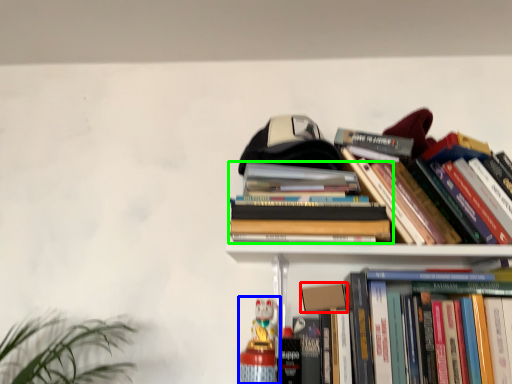
Question: Which object is positioned farthest from paperback book (highlighted by a red box)? Select from toy (highlighted by a blue box) and book (highlighted by a green box).

Choices:
 (A) toy
 (B) book

Answer: (B)